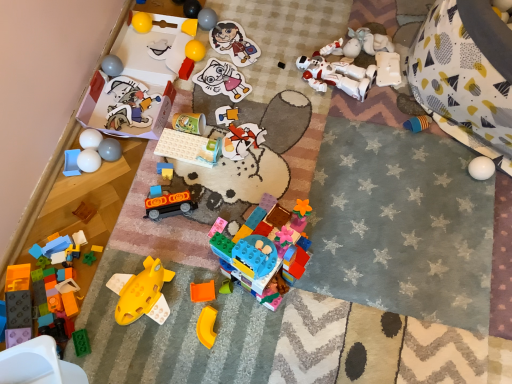
Locate an element on the screen. The image size is (512, 384). free space that is in between matte plastic blocks at center, the 9th toy viewed from the left, and orange matte toy airplane at center, the 16th toy positioned from the left is located at coordinates (185, 237).